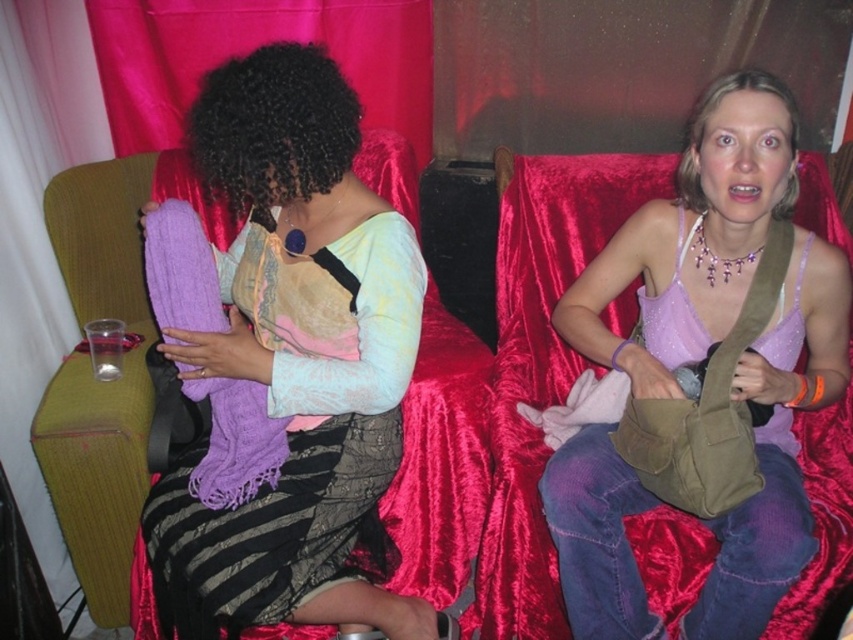
Question: Which point is farther from the camera taking this photo?

Choices:
 (A) (381, 467)
 (B) (752, 580)
 (C) (242, 429)

Answer: (A)

Question: Can you confirm if matte purple scarf at upper right is positioned above purple soft scarf at center?

Choices:
 (A) no
 (B) yes

Answer: (A)

Question: Which point appears closest to the camera in this image?

Choices:
 (A) (213, 317)
 (B) (756, 161)

Answer: (B)

Question: Which of the following is the closest to the observer?

Choices:
 (A) matte purple scarf at left
 (B) matte purple scarf at upper right
 (C) purple soft scarf at center

Answer: (A)

Question: Is matte purple scarf at left smaller than matte purple scarf at upper right?

Choices:
 (A) yes
 (B) no

Answer: (B)

Question: Is matte purple scarf at upper right to the left of purple soft scarf at center from the viewer's perspective?

Choices:
 (A) yes
 (B) no

Answer: (B)